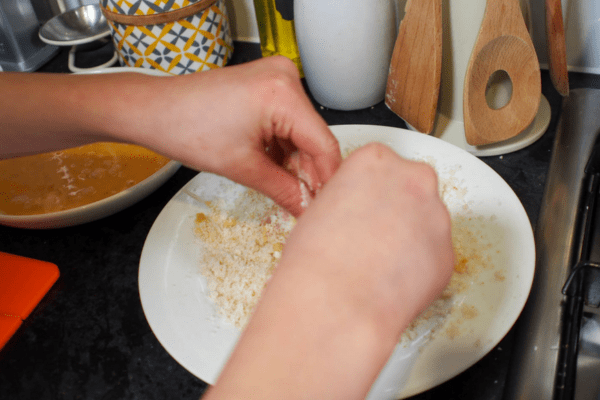
This screenshot has width=600, height=400. I want to click on wooden spatula, so [x=420, y=66].